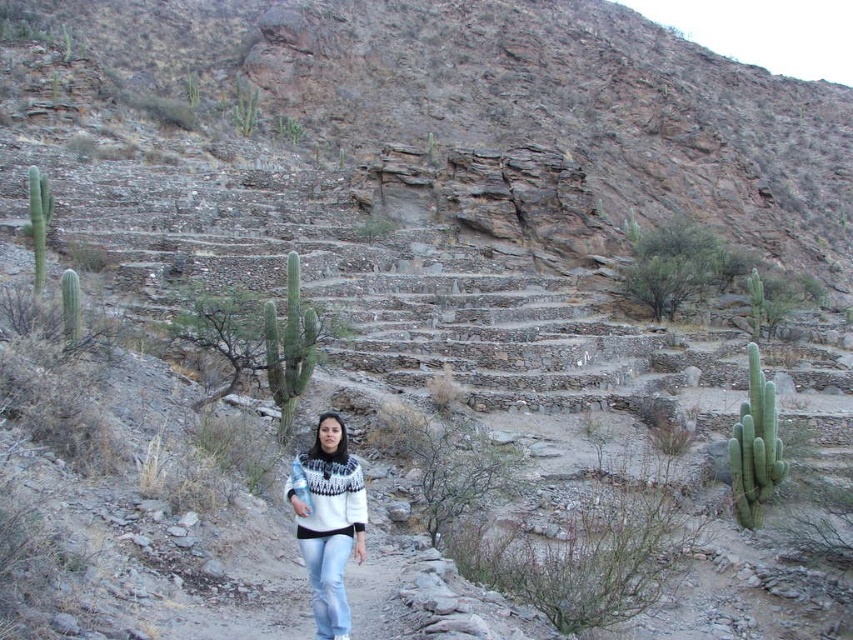
Looking at this image, does brown rocky hillside at upper center have a lesser height compared to white knitwear at center?

Incorrect, brown rocky hillside at upper center's height does not fall short of white knitwear at center's.

Who is taller, brown rocky hillside at upper center or white knitwear at center?

With more height is brown rocky hillside at upper center.

Does point (712, 188) come farther from viewer compared to point (305, 484)?

That is True.

This screenshot has width=853, height=640. Identify the location of brown rocky hillside at upper center. (521, 97).

Which is above, white knit sweater at center or green spiny cactus at center?

Positioned higher is green spiny cactus at center.

Is the position of white knit sweater at center more distant than that of green spiny cactus at center?

No.

The width and height of the screenshot is (853, 640). What do you see at coordinates (329, 522) in the screenshot?
I see `white knit sweater at center` at bounding box center [329, 522].

Identify the location of white knit sweater at center. The image size is (853, 640). (329, 522).

Which is below, green spiny cactus at right or green spiny cactus at left?

Positioned lower is green spiny cactus at right.

Is point (741, 467) closer to camera compared to point (35, 276)?

Yes.

Describe the element at coordinates (753, 445) in the screenshot. I see `green spiny cactus at right` at that location.

This screenshot has height=640, width=853. In order to click on green spiny cactus at right in this screenshot , I will do `click(753, 445)`.